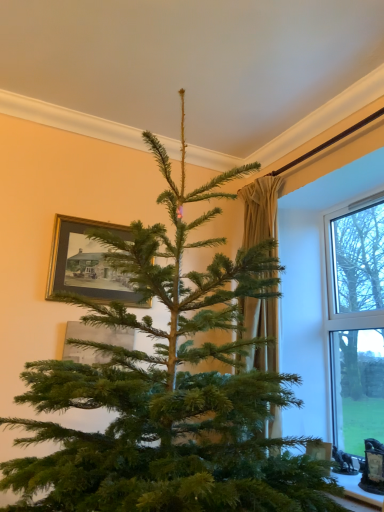
Question: Can you confirm if white plastic window at right is smaller than gold-framed picture at upper left, the 2th picture frame from the bottom?

Choices:
 (A) yes
 (B) no

Answer: (B)

Question: From a real-world perspective, is white plastic window at right on gold-framed picture at upper left, positioned as the 1th picture frame in top-to-bottom order?

Choices:
 (A) no
 (B) yes

Answer: (A)

Question: Is white plastic window at right thinner than gold-framed picture at upper left, positioned as the 1th picture frame in top-to-bottom order?

Choices:
 (A) yes
 (B) no

Answer: (B)

Question: Does white plastic window at right appear on the left side of gold-framed picture at upper left, positioned as the 1th picture frame in top-to-bottom order?

Choices:
 (A) no
 (B) yes

Answer: (A)

Question: Could gold-framed picture at upper left, positioned as the 1th picture frame in top-to-bottom order, be considered to be inside white plastic window at right?

Choices:
 (A) no
 (B) yes

Answer: (A)

Question: Is point (380, 318) closer or farther from the camera than point (337, 217)?

Choices:
 (A) closer
 (B) farther

Answer: (A)

Question: Is transparent glass window at right wider or thinner than white plastic window at right?

Choices:
 (A) thin
 (B) wide

Answer: (A)

Question: Is transparent glass window at right in front of or behind white plastic window at right in the image?

Choices:
 (A) behind
 (B) front

Answer: (B)

Question: Is transparent glass window at right bigger or smaller than white plastic window at right?

Choices:
 (A) small
 (B) big

Answer: (A)

Question: Based on their sizes in the image, would you say gold-framed picture at upper left, positioned as the 1th picture frame in top-to-bottom order, is bigger or smaller than beige fabric curtain at center?

Choices:
 (A) big
 (B) small

Answer: (B)

Question: From a real-world perspective, is gold-framed picture at upper left, positioned as the 1th picture frame in top-to-bottom order, physically located above or below beige fabric curtain at center?

Choices:
 (A) below
 (B) above

Answer: (B)

Question: Considering the positions of point (107, 265) and point (248, 225), is point (107, 265) closer or farther from the camera than point (248, 225)?

Choices:
 (A) farther
 (B) closer

Answer: (B)

Question: Is gold-framed picture at upper left, the 2th picture frame from the bottom, taller or shorter than beige fabric curtain at center?

Choices:
 (A) short
 (B) tall

Answer: (A)

Question: Is gold-framed picture at upper left, positioned as the 1th picture frame in top-to-bottom order, bigger or smaller than white plastic window at right?

Choices:
 (A) small
 (B) big

Answer: (A)

Question: Is gold-framed picture at upper left, the 2th picture frame from the bottom, inside or outside of white plastic window at right?

Choices:
 (A) inside
 (B) outside

Answer: (B)